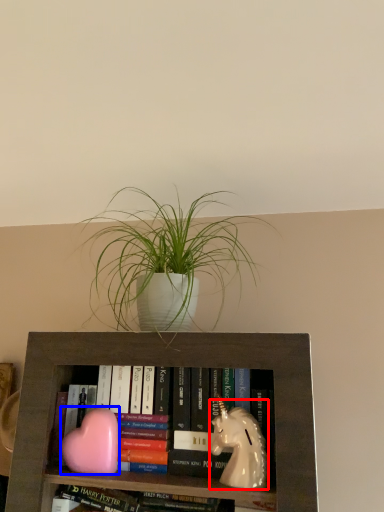
Question: Which point is closer to the camera, animal (highlighted by a red box) or animal (highlighted by a blue box)?

Choices:
 (A) animal
 (B) animal

Answer: (A)